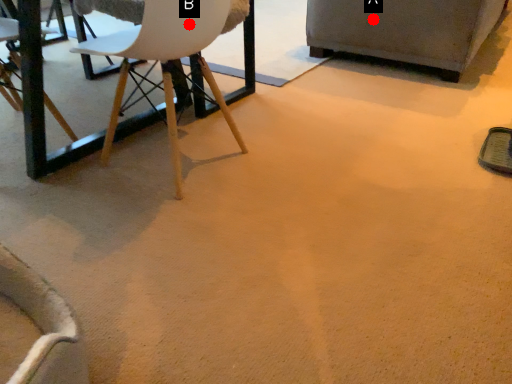
Question: Two points are circled on the image, labeled by A and B beside each circle. Which point is closer to the camera taking this photo?

Choices:
 (A) A is closer
 (B) B is closer

Answer: (B)